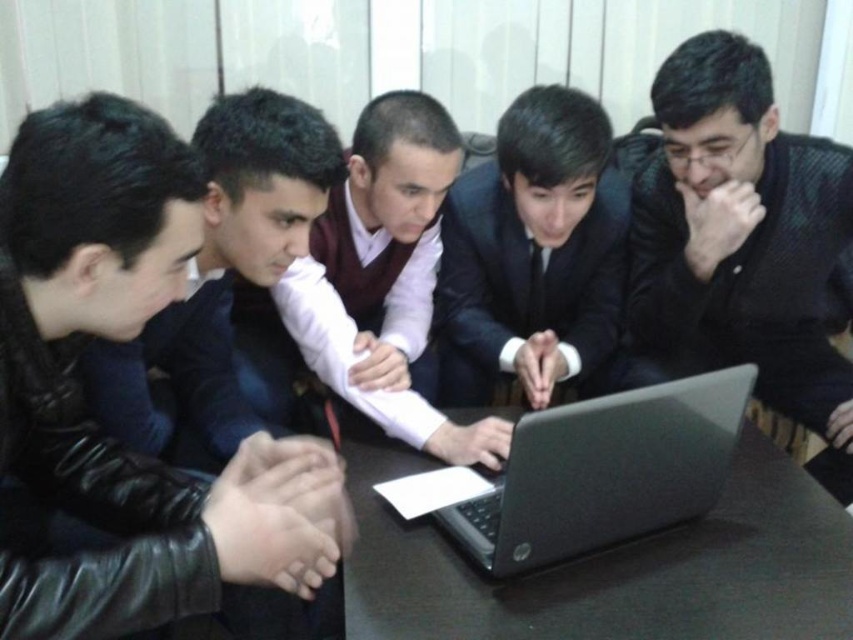
Question: Observing the image, what is the correct spatial positioning of black textured shirt at center in reference to black matte laptop at center?

Choices:
 (A) above
 (B) below

Answer: (A)

Question: From the image, what is the correct spatial relationship of black matte table at center in relation to black satin suit at center?

Choices:
 (A) above
 (B) below

Answer: (B)

Question: From the image, what is the correct spatial relationship of black matte table at center in relation to black satin suit at center?

Choices:
 (A) right
 (B) left

Answer: (B)

Question: Based on their relative distances, which object is farther from the black textured shirt at center?

Choices:
 (A) black matte laptop at center
 (B) black matte table at center
 (C) matte white shirt at center
 (D) matte black jacket at left

Answer: (D)

Question: Estimate the real-world distances between objects in this image. Which object is closer to the black satin suit at center?

Choices:
 (A) matte white shirt at center
 (B) black matte laptop at center
 (C) black matte table at center

Answer: (A)

Question: Which of the following is the farthest from the observer?

Choices:
 (A) black leather business suit at lower left
 (B) black matte laptop at center

Answer: (B)